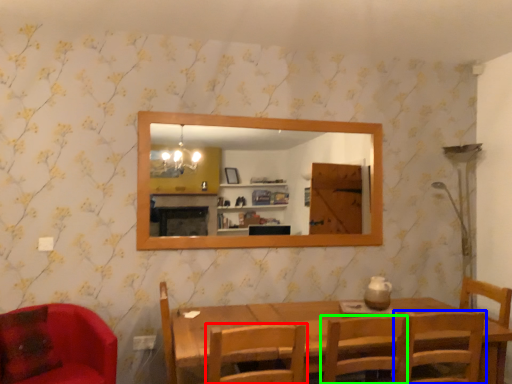
Question: Estimate the real-world distances between objects in this image. Which object is closer to chair (highlighted by a red box), chair (highlighted by a blue box) or chair (highlighted by a green box)?

Choices:
 (A) chair
 (B) chair

Answer: (B)